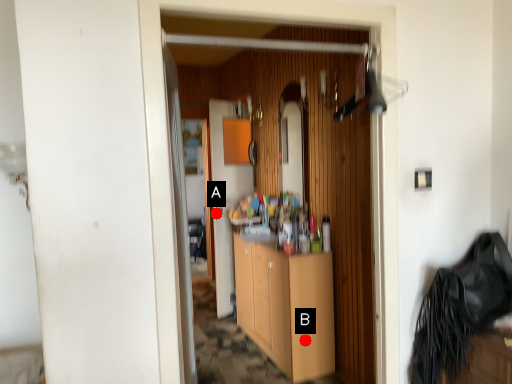
Question: Two points are circled on the image, labeled by A and B beside each circle. Among these points, which one is farthest from the camera?

Choices:
 (A) A is further
 (B) B is further

Answer: (A)